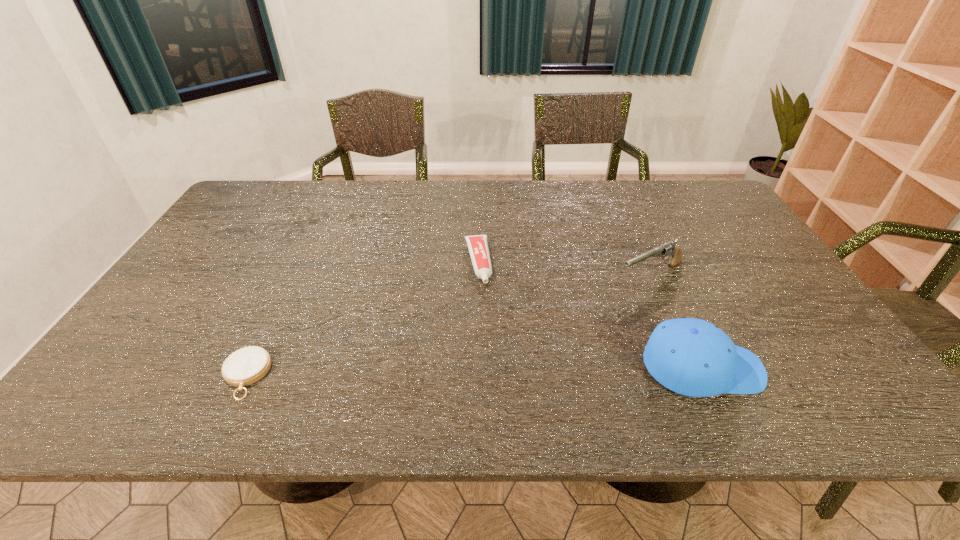
Where is `the leftmost object`? The image size is (960, 540). the leftmost object is located at coordinates (245, 366).

Identify the location of compass. This screenshot has width=960, height=540. (245, 366).

Where is `the tallest object`? The width and height of the screenshot is (960, 540). the tallest object is located at coordinates (693, 357).

You are a GUI agent. You are given a task and a screenshot of the screen. Output one action in this format:
    pyautogui.click(x=<x>, y=<y>)
    Task: Click on the gun
    Image resolution: width=960 pixels, height=540 pixels.
    Given the screenshot: What is the action you would take?
    pyautogui.click(x=667, y=249)

Identify the location of toothpaste. 477,244.

The image size is (960, 540). What are the coordinates of `the second shortest object` in the screenshot? It's located at (477, 244).

This screenshot has height=540, width=960. What are the coordinates of `vacant area situated 0.300m on the right of the leftmost object` in the screenshot? It's located at (404, 375).

Where is `vacant space situated on the front-facing side of the tallest object`? vacant space situated on the front-facing side of the tallest object is located at coordinates (783, 368).

The image size is (960, 540). What are the coordinates of `vacant space positioned aiming along the barrel of the gun` in the screenshot? It's located at (527, 330).

I want to click on free space located aiming along the barrel of the gun, so click(x=510, y=339).